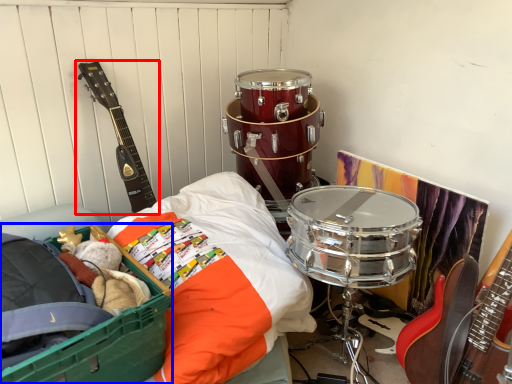
Question: Which object appears farthest to the camera in this image, guitar (highlighted by a red box) or storage box (highlighted by a blue box)?

Choices:
 (A) guitar
 (B) storage box

Answer: (A)